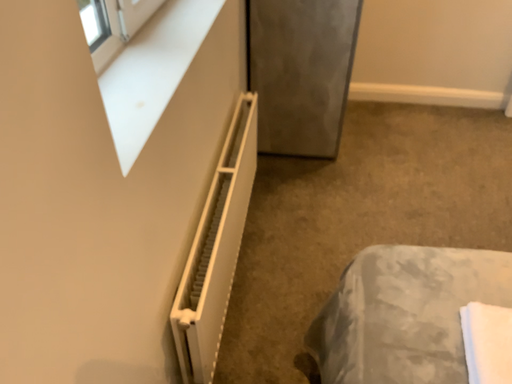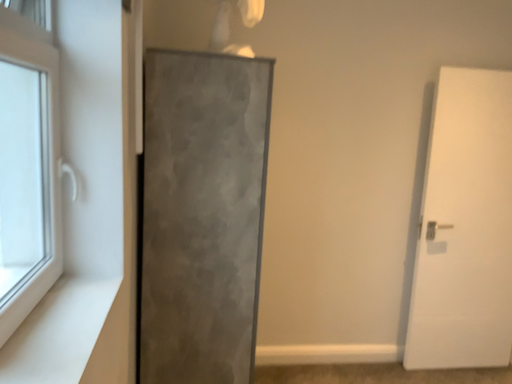
Question: How did the camera likely rotate when shooting the video?

Choices:
 (A) rotated downward
 (B) rotated upward

Answer: (B)